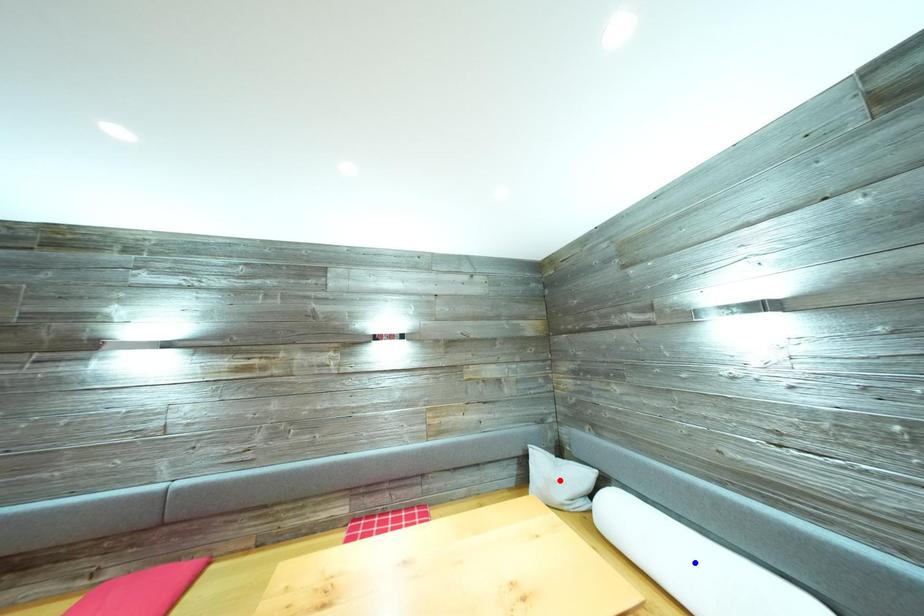
Question: Which of the two points in the image is closer to the camera?

Choices:
 (A) Blue point is closer.
 (B) Red point is closer.

Answer: (A)